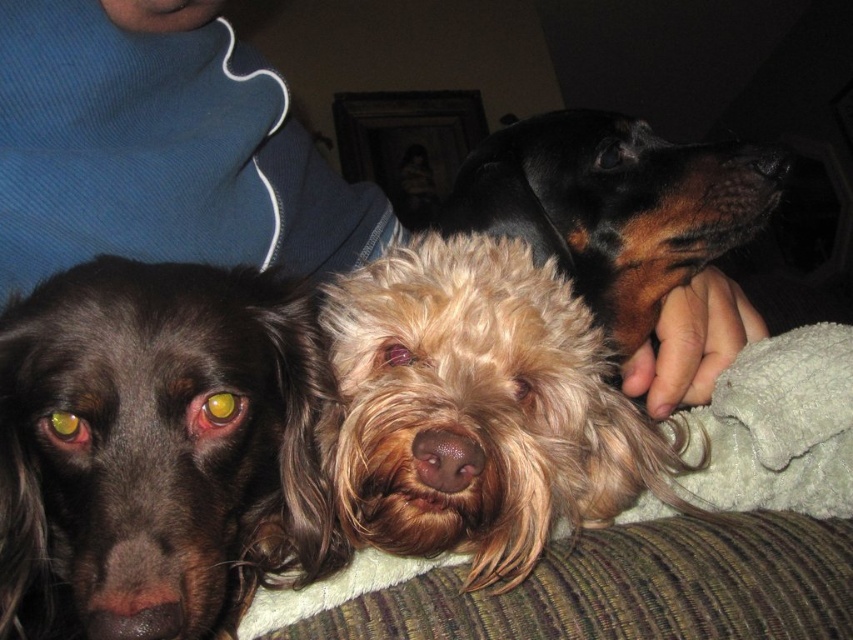
Who is higher up, brown shaggy dog at center or fuzzy brown dog at center?

fuzzy brown dog at center is above.

Find the location of a particular element. This screenshot has width=853, height=640. brown shaggy dog at center is located at coordinates (161, 445).

Is point (82, 298) behind point (486, 349)?

No, it is not.

The height and width of the screenshot is (640, 853). In order to click on brown shaggy dog at center in this screenshot , I will do `click(161, 445)`.